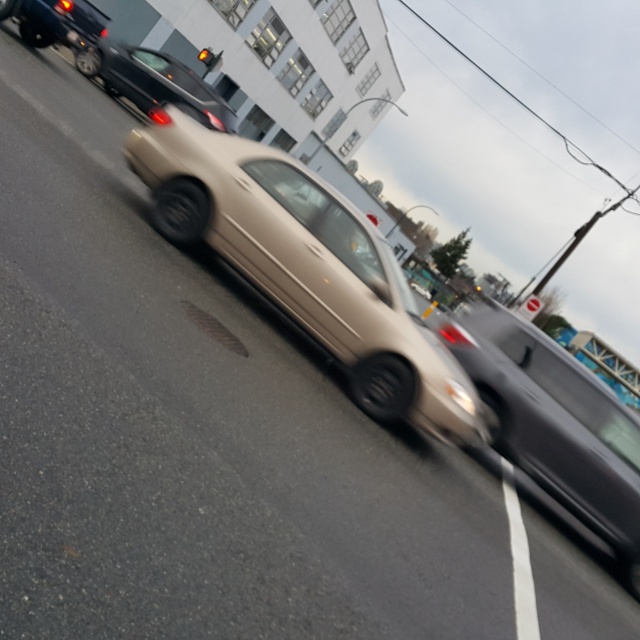
In the scene shown: Between satin beige sedan at center and matte silver sedan at center, which one has less height?

matte silver sedan at center is shorter.

Locate an element on the screen. satin beige sedan at center is located at coordinates (305, 266).

Is point (163, 227) positioned after point (509, 403)?

No, it is in front of (509, 403).

Where is `satin beige sedan at center`? This screenshot has height=640, width=640. satin beige sedan at center is located at coordinates coord(305,266).

Which is more to the right, matte silver sedan at center or amber glass traffic light at upper center?

matte silver sedan at center is more to the right.

Does point (636, 429) come behind point (209, 51)?

No, it is in front of (209, 51).

Is point (483, 301) positioned before point (205, 60)?

That is True.

Identify the location of matte silver sedan at center. (554, 422).

The image size is (640, 640). What do you see at coordinates (305, 266) in the screenshot? I see `satin beige sedan at center` at bounding box center [305, 266].

Can you confirm if satin beige sedan at center is positioned below shiny black car at upper left?

Indeed, satin beige sedan at center is positioned under shiny black car at upper left.

The image size is (640, 640). Find the location of `satin beige sedan at center`. satin beige sedan at center is located at coordinates (305, 266).

Where is `satin beige sedan at center`? The width and height of the screenshot is (640, 640). satin beige sedan at center is located at coordinates (305, 266).